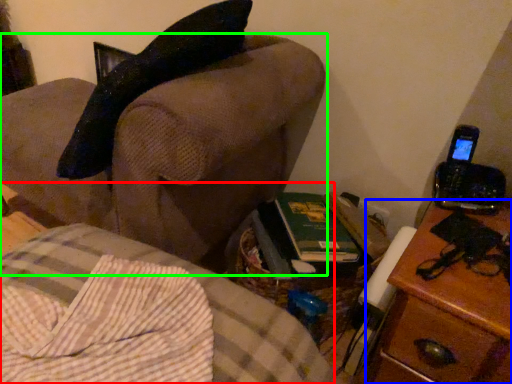
Question: Which is farther away from furniture (highlighted by a red box)? nightstand (highlighted by a blue box) or furniture (highlighted by a green box)?

Choices:
 (A) nightstand
 (B) furniture

Answer: (A)